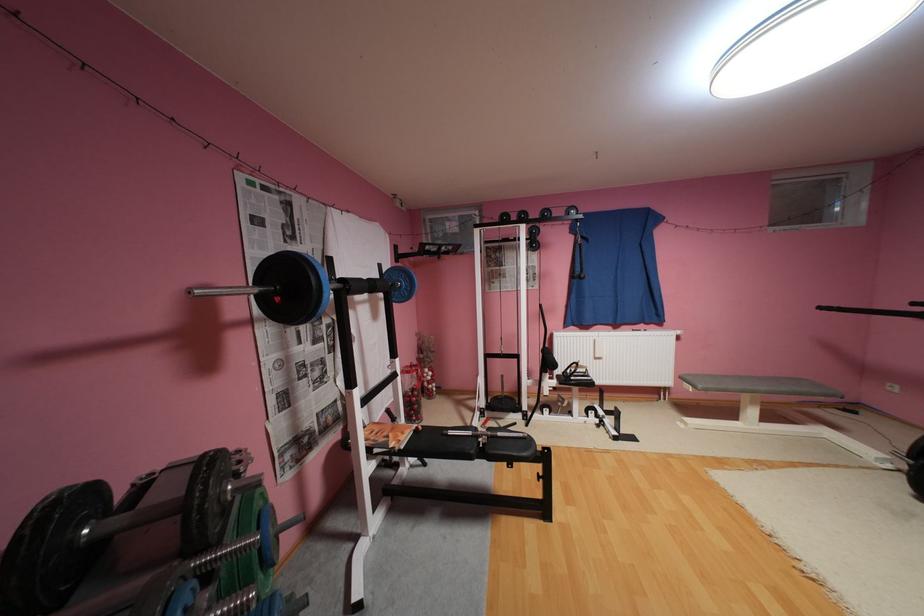
What are the coordinates of `black bench sitting surface` in the screenshot? It's located at (757, 390).